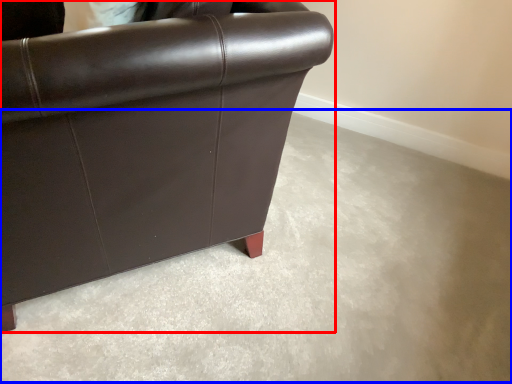
Question: Which point is closer to the camera, chair (highlighted by a red box) or concrete (highlighted by a blue box)?

Choices:
 (A) chair
 (B) concrete

Answer: (A)